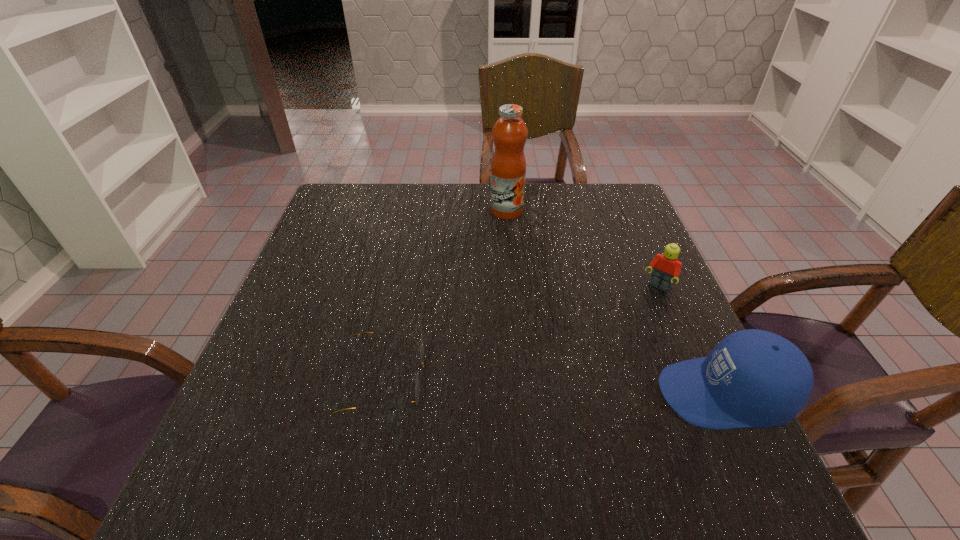
You are a GUI agent. You are given a task and a screenshot of the screen. Output one action in this format:
    pyautogui.click(x=<x>, y=<y>)
    Task: Click on the Lego that is positioned at the right edge
    This screenshot has height=540, width=960.
    Given the screenshot: What is the action you would take?
    pyautogui.click(x=667, y=267)

Identify the location of object that is at the near right corner. (753, 378).

Where is `vacant space at the far edge of the desktop`? The height and width of the screenshot is (540, 960). vacant space at the far edge of the desktop is located at coordinates (443, 216).

Locate an element on the screen. vacant area at the near edge is located at coordinates (622, 436).

Locate an element on the screen. Image resolution: width=960 pixels, height=540 pixels. vacant region at the left edge is located at coordinates (358, 276).

This screenshot has height=540, width=960. What are the coordinates of `free location at the right edge` in the screenshot? It's located at (627, 341).

The image size is (960, 540). I want to click on free region at the far left corner of the desktop, so click(350, 186).

I want to click on vacant position at the near left corner of the desktop, so click(310, 401).

In the image, there is a desktop. Where is `vacant space at the far right corner`? Image resolution: width=960 pixels, height=540 pixels. vacant space at the far right corner is located at coordinates (635, 215).

This screenshot has height=540, width=960. I want to click on free space that is in between the shortest object and the cap, so click(x=554, y=387).